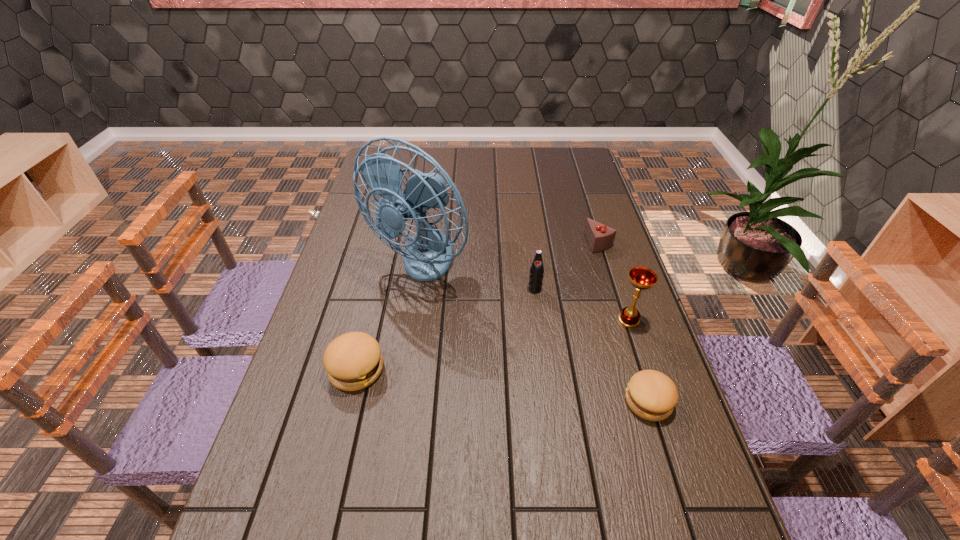
At what (x,y) coordinates should I click in order to perform the action: click on free space between the taller hamburger and the pop. Please return your answer as a coordinate pair (x, y). This screenshot has height=540, width=960. Looking at the image, I should click on (445, 329).

You are a GUI agent. You are given a task and a screenshot of the screen. Output one action in this format:
    pyautogui.click(x=<x>, y=<y>)
    Task: Click on the vacant area that lies between the taller hamburger and the fan
    
    Given the screenshot: What is the action you would take?
    pyautogui.click(x=388, y=317)

Locate which object ranks in proximity to the chocolate cake. Please provide its 2D coordinates. Your answer should be formatted as a tuple, i.e. [(x, y)], where the tuple contains the x and y coordinates of a point satisfying the conditions above.

[(536, 271)]

Identify which object is located as the nearest to the pop. Please provide its 2D coordinates. Your answer should be formatted as a tuple, i.e. [(x, y)], where the tuple contains the x and y coordinates of a point satisfying the conditions above.

[(428, 255)]

Locate an element on the screen. Image resolution: width=960 pixels, height=540 pixels. free point that satisfies the following two spatial constraints: 1. in front of the tallest object to blow air; 2. on the right side of the third nearest object is located at coordinates (410, 320).

Where is `blank area in the image that satisfies the following two spatial constraints: 1. on the front label of the right hamburger; 2. on the left side of the fourth shortest object`? This screenshot has height=540, width=960. blank area in the image that satisfies the following two spatial constraints: 1. on the front label of the right hamburger; 2. on the left side of the fourth shortest object is located at coordinates (549, 402).